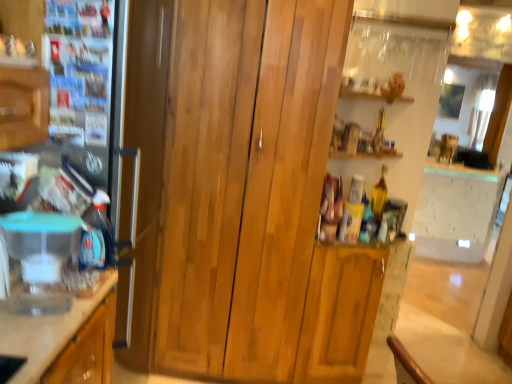
What do you see at coordinates (41, 256) in the screenshot?
I see `transparent plastic container at left` at bounding box center [41, 256].

What do you see at coordinates (143, 170) in the screenshot? I see `satin silver fridge at left` at bounding box center [143, 170].

The image size is (512, 384). Identify the location of transparent plastic container at left. (41, 256).

Is wooden cabinet at center next to clear plastic container at left and touching it?

wooden cabinet at center is not next to clear plastic container at left, and they're not touching.

I want to click on dresser that appears above the clear plastic container at left (from a real-world perspective), so click(267, 208).

Looking at this image, considering the relative sizes of wooden cabinet at center and clear plastic container at left in the image provided, is wooden cabinet at center thinner than clear plastic container at left?

Indeed, wooden cabinet at center has a lesser width compared to clear plastic container at left.

Which of these two, wooden cabinet at center or clear plastic container at left, stands taller?

With more height is wooden cabinet at center.

Is the position of transparent plastic container at left more distant than that of wooden cabinet at center?

No, the depth of transparent plastic container at left is less than that of wooden cabinet at center.

In terms of width, does transparent plastic container at left look wider or thinner when compared to wooden cabinet at center?

Considering their sizes, transparent plastic container at left looks slimmer than wooden cabinet at center.

Is transparent plastic container at left far from wooden cabinet at center?

That's not correct — transparent plastic container at left is a little close to wooden cabinet at center.

Is wooden cabinet at center to the right of transparent plastic container at left from the viewer's perspective?

Yes, wooden cabinet at center is to the right of transparent plastic container at left.

Is point (269, 80) closer or farther from the camera than point (49, 277)?

Clearly, point (269, 80) is more distant from the camera than point (49, 277).

From the image's perspective, is wooden cabinet at center beneath transparent plastic container at left?

No, from the image's perspective, wooden cabinet at center is not below transparent plastic container at left.

Is wooden cabinet at center not inside transparent plastic container at left?

wooden cabinet at center lies outside transparent plastic container at left's area.

From the image's perspective, does satin silver fridge at left appear higher than wooden cabinet at center?

No, from the image's perspective, satin silver fridge at left is not over wooden cabinet at center.

Which object is positioned more to the left, satin silver fridge at left or wooden cabinet at center?

Positioned to the left is satin silver fridge at left.

Based on their sizes in the image, would you say satin silver fridge at left is bigger or smaller than wooden cabinet at center?

satin silver fridge at left is smaller than wooden cabinet at center.

Is clear plastic container at left positioned before wooden cabinet at center?

Yes.

Is clear plastic container at left oriented towards wooden cabinet at center?

No, clear plastic container at left is not aimed at wooden cabinet at center.

Is clear plastic container at left smaller than wooden cabinet at center?

Yes, clear plastic container at left is smaller than wooden cabinet at center.

Is clear plastic container at left not inside wooden cabinet at center?

clear plastic container at left is positioned outside wooden cabinet at center.

Where is `fridge that appears below the wooden cabinet at center (from a real-world perspective)`? This screenshot has width=512, height=384. fridge that appears below the wooden cabinet at center (from a real-world perspective) is located at coordinates (143, 170).

Which of these two, wooden cabinet at center or satin silver fridge at left, stands shorter?

With less height is satin silver fridge at left.

Is satin silver fridge at left at the back of wooden cabinet at center?

No, wooden cabinet at center is not facing the opposite direction of satin silver fridge at left.

Considering the relative positions of wooden cabinet at center and satin silver fridge at left in the image provided, is wooden cabinet at center to the left of satin silver fridge at left from the viewer's perspective?

Incorrect, wooden cabinet at center is not on the left side of satin silver fridge at left.

From their relative heights in the image, would you say clear plastic container at left is taller or shorter than transparent plastic container at left?

In the image, clear plastic container at left appears to be taller than transparent plastic container at left.

The height and width of the screenshot is (384, 512). Find the location of `cabinetry that is in front of the transparent plastic container at left`. cabinetry that is in front of the transparent plastic container at left is located at coordinates (45, 332).

Between point (48, 360) and point (56, 303), which one is positioned behind?

The point (56, 303) is farther.

Is clear plastic container at left beside transparent plastic container at left?

No, clear plastic container at left is not beside transparent plastic container at left.

There is a clear plastic container at left. Find the location of `dresser above it (from a real-world perspective)`. dresser above it (from a real-world perspective) is located at coordinates (267, 208).

Where is `appliance lying on the left of wooden cabinet at center`? appliance lying on the left of wooden cabinet at center is located at coordinates (41, 256).

Based on their spatial positions, is clear plastic container at left or transparent plastic container at left closer to satin silver fridge at left?

transparent plastic container at left.

Considering their positions, is satin silver fridge at left positioned further to transparent plastic container at left than clear plastic container at left?

Based on the image, satin silver fridge at left appears to be further to transparent plastic container at left.

From the image, which object appears to be nearer to wooden cabinet at center, clear plastic container at left or transparent plastic container at left?

transparent plastic container at left.

Which object lies further to the anchor point transparent plastic container at left, clear plastic container at left or satin silver fridge at left?

satin silver fridge at left is positioned further to the anchor transparent plastic container at left.

Estimate the real-world distances between objects in this image. Which object is further from clear plastic container at left, wooden cabinet at center or satin silver fridge at left?

Among the two, wooden cabinet at center is located further to clear plastic container at left.

Estimate the real-world distances between objects in this image. Which object is closer to wooden cabinet at center, satin silver fridge at left or transparent plastic container at left?

The object closer to wooden cabinet at center is satin silver fridge at left.

Based on their spatial positions, is transparent plastic container at left or wooden cabinet at center further from clear plastic container at left?

Based on the image, wooden cabinet at center appears to be further to clear plastic container at left.

Estimate the real-world distances between objects in this image. Which object is further from wooden cabinet at center, clear plastic container at left or satin silver fridge at left?

Based on the image, clear plastic container at left appears to be further to wooden cabinet at center.

The width and height of the screenshot is (512, 384). In order to click on appliance that lies between satin silver fridge at left and clear plastic container at left from top to bottom in this screenshot , I will do `click(41, 256)`.

At what (x,y) coordinates should I click in order to perform the action: click on appliance located between satin silver fridge at left and wooden cabinet at center in the left-right direction. Please return your answer as a coordinate pair (x, y). Looking at the image, I should click on 41,256.

The width and height of the screenshot is (512, 384). I want to click on appliance between clear plastic container at left and wooden cabinet at center, so click(x=41, y=256).

The image size is (512, 384). Identify the location of cabinetry situated between satin silver fridge at left and wooden cabinet at center from left to right. (45, 332).